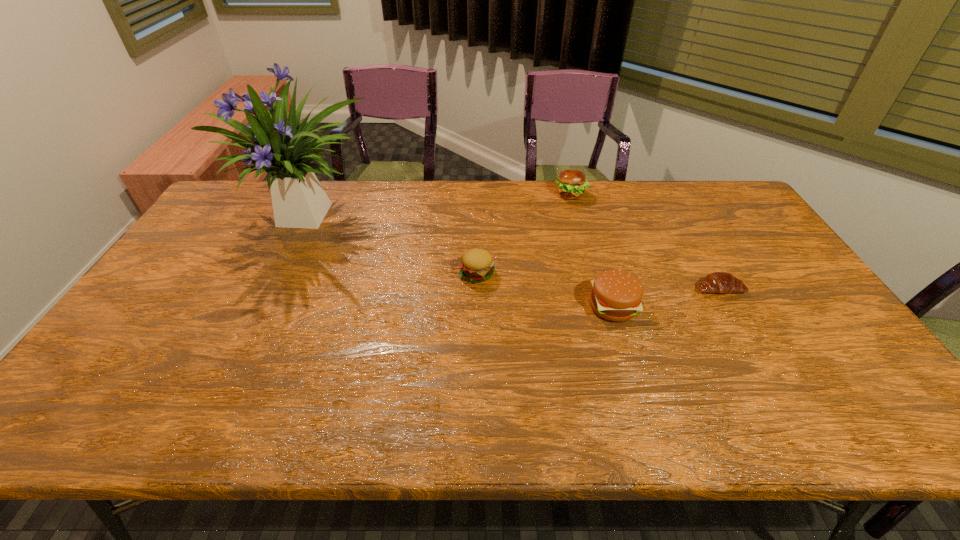
Locate an element on the screen. The image size is (960, 540). free space located on the back of the nearest hamburger is located at coordinates (591, 235).

Locate an element on the screen. This screenshot has height=540, width=960. free space located on the front of the second shortest object is located at coordinates (477, 304).

Where is `free space located on the right of the rightmost object`? free space located on the right of the rightmost object is located at coordinates (785, 288).

This screenshot has height=540, width=960. Identify the location of flower arrangement that is at the far edge. (299, 201).

Find the location of a particular element. The height and width of the screenshot is (540, 960). hamburger that is at the far edge is located at coordinates (571, 184).

This screenshot has width=960, height=540. In order to click on object present at the left edge in this screenshot , I will do `click(299, 201)`.

Locate an element on the screen. This screenshot has height=540, width=960. object that is at the far left corner is located at coordinates (299, 201).

Locate an element on the screen. This screenshot has height=540, width=960. free point at the far edge is located at coordinates (635, 191).

Where is `free space at the near edge of the desktop`? free space at the near edge of the desktop is located at coordinates (192, 408).

Locate an element on the screen. Image resolution: width=960 pixels, height=540 pixels. free space at the left edge is located at coordinates (155, 354).